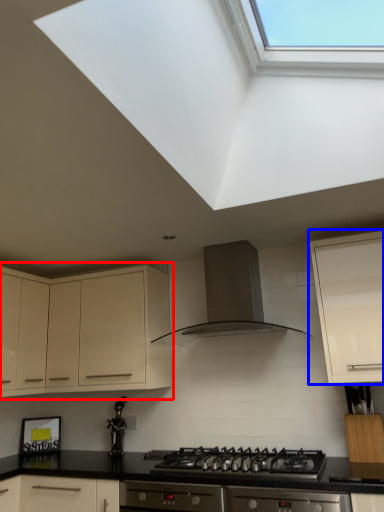
Question: Which object is closer to the camera taking this photo, cabinetry (highlighted by a red box) or cabinetry (highlighted by a blue box)?

Choices:
 (A) cabinetry
 (B) cabinetry

Answer: (B)